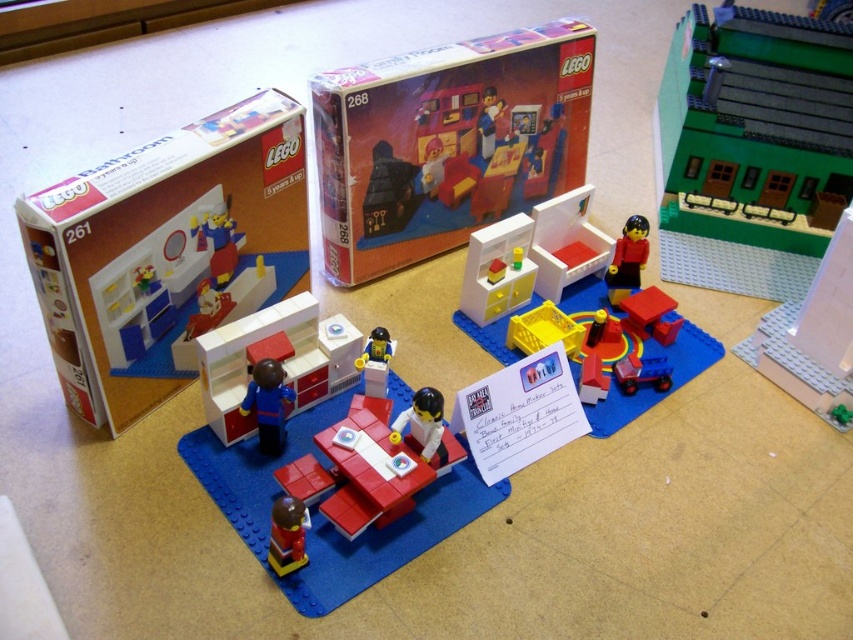
Does matte white bathroom set at left appear on the right side of yellow plastic crate at center?

In fact, matte white bathroom set at left is to the left of yellow plastic crate at center.

Can you confirm if matte white bathroom set at left is thinner than yellow plastic crate at center?

No, matte white bathroom set at left is not thinner than yellow plastic crate at center.

The image size is (853, 640). What do you see at coordinates (166, 252) in the screenshot?
I see `matte white bathroom set at left` at bounding box center [166, 252].

Find the location of a particular element. The height and width of the screenshot is (640, 853). matte white bathroom set at left is located at coordinates (166, 252).

Is point (265, 436) farther from camera compared to point (544, 305)?

That is False.

Which is more to the right, blue plastic figure at center or yellow plastic crate at center?

From the viewer's perspective, yellow plastic crate at center appears more on the right side.

Which is in front, point (271, 372) or point (566, 330)?

Point (271, 372)

I want to click on blue plastic figure at center, so click(267, 403).

Can you confirm if smooth red toy at center is positioned below smooth red truck at center?

Yes.

Does smooth red toy at center appear over smooth red truck at center?

No.

Between point (291, 556) and point (624, 310), which one is positioned behind?

The point (624, 310) is behind.

This screenshot has width=853, height=640. I want to click on smooth red toy at center, so click(x=287, y=534).